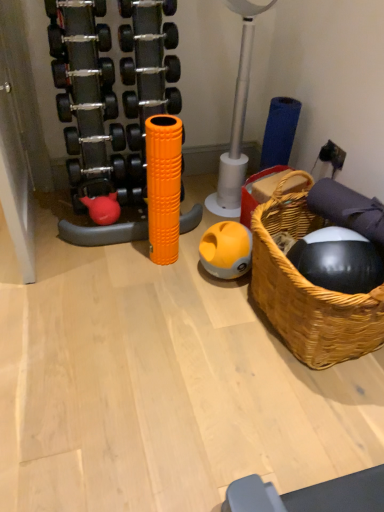
Where is `unoccupied area in front of woven wood basket at right`? The height and width of the screenshot is (512, 384). unoccupied area in front of woven wood basket at right is located at coordinates (289, 420).